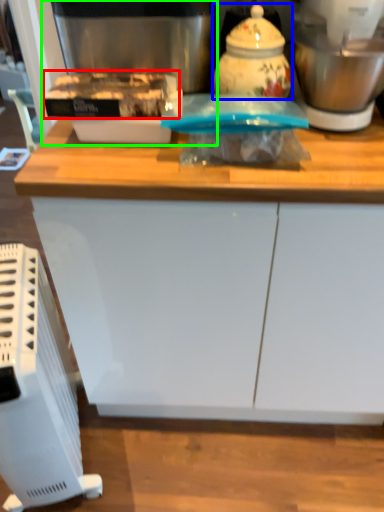
Question: Which is farther away from food (highlighted by a red box)? kitchen appliance (highlighted by a blue box) or coffee machine (highlighted by a green box)?

Choices:
 (A) kitchen appliance
 (B) coffee machine

Answer: (A)